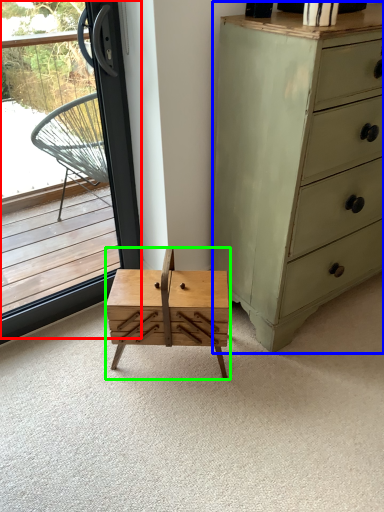
Question: Based on their relative distances, which object is farther from window (highlighted by a red box)? Choose from chest of drawers (highlighted by a blue box) and table (highlighted by a green box).

Choices:
 (A) chest of drawers
 (B) table

Answer: (A)